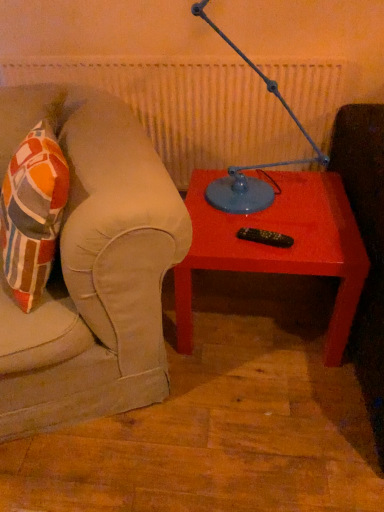
Question: Is matte red table at center taller or shorter than blue metallic table lamp at upper center?

Choices:
 (A) tall
 (B) short

Answer: (B)

Question: From a real-world perspective, is matte red table at center positioned above or below blue metallic table lamp at upper center?

Choices:
 (A) above
 (B) below

Answer: (B)

Question: From the image's perspective, is matte red table at center located above or below blue metallic table lamp at upper center?

Choices:
 (A) above
 (B) below

Answer: (B)

Question: In the image, is blue metallic table lamp at upper center positioned in front of or behind matte red table at center?

Choices:
 (A) behind
 (B) front

Answer: (B)

Question: Would you say blue metallic table lamp at upper center is inside or outside matte red table at center?

Choices:
 (A) outside
 (B) inside

Answer: (A)

Question: In terms of size, does blue metallic table lamp at upper center appear bigger or smaller than matte red table at center?

Choices:
 (A) small
 (B) big

Answer: (A)

Question: From their relative heights in the image, would you say blue metallic table lamp at upper center is taller or shorter than matte red table at center?

Choices:
 (A) short
 (B) tall

Answer: (B)